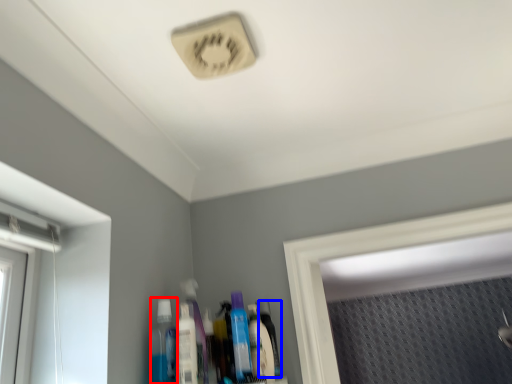
Question: Which object is further to the camera taking this photo, mouthwash (highlighted by a red box) or bottle (highlighted by a blue box)?

Choices:
 (A) mouthwash
 (B) bottle

Answer: (B)